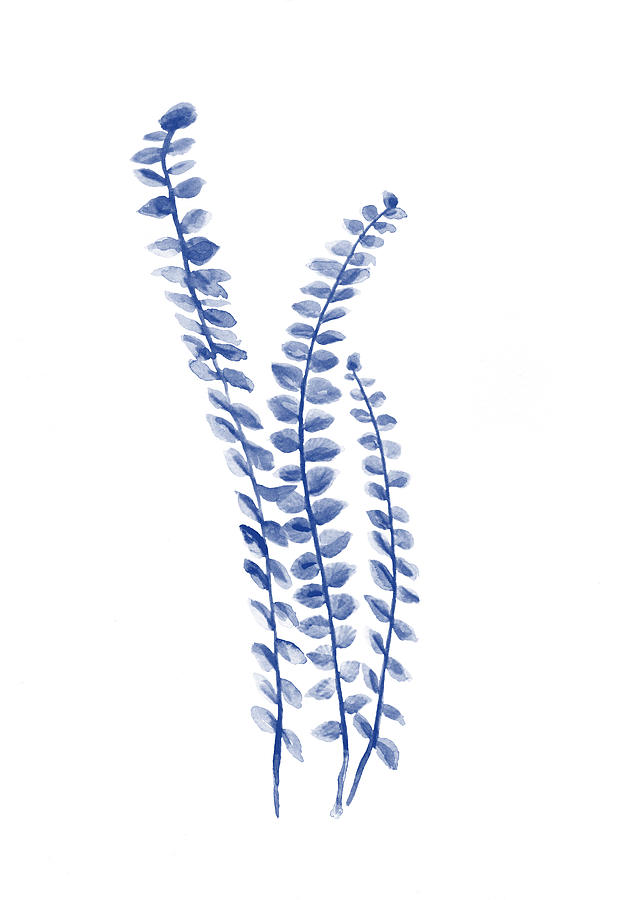
Where is `painting`? The height and width of the screenshot is (900, 621). painting is located at coordinates (322, 101).